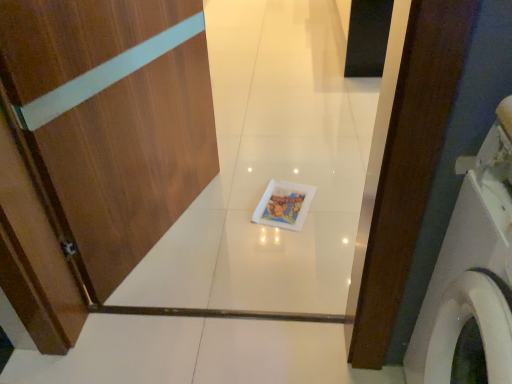
Question: Visually, is white glossy washing machine at right positioned to the left or to the right of wooden door at center?

Choices:
 (A) right
 (B) left

Answer: (A)

Question: Is white glossy washing machine at right in front of or behind wooden door at center in the image?

Choices:
 (A) front
 (B) behind

Answer: (A)

Question: Does point (499, 355) appear closer or farther from the camera than point (189, 188)?

Choices:
 (A) closer
 (B) farther

Answer: (A)

Question: Which is correct: wooden door at center is inside white glossy washing machine at right, or outside of it?

Choices:
 (A) outside
 (B) inside

Answer: (A)

Question: From a real-world perspective, relative to white glossy washing machine at right, is wooden door at center vertically above or below?

Choices:
 (A) below
 (B) above

Answer: (B)

Question: In the image, is wooden door at center on the left side or the right side of white glossy washing machine at right?

Choices:
 (A) left
 (B) right

Answer: (A)

Question: Considering the positions of wooden door at center and white glossy washing machine at right in the image, is wooden door at center bigger or smaller than white glossy washing machine at right?

Choices:
 (A) big
 (B) small

Answer: (B)